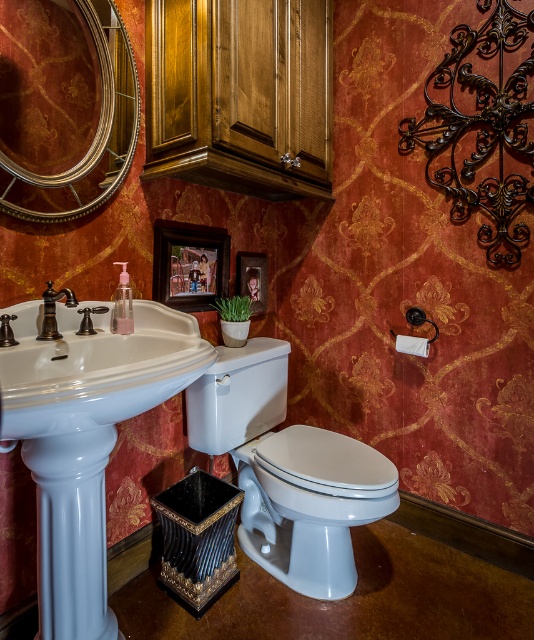
You are standing in the bathroom and want to place a small plant between the two points marked as point [277,563] and point [44,292]. Which point should the plant be closer to in order to be nearer to the viewer?

The plant should be closer to point [277,563] because it is further to the viewer than point [44,292].